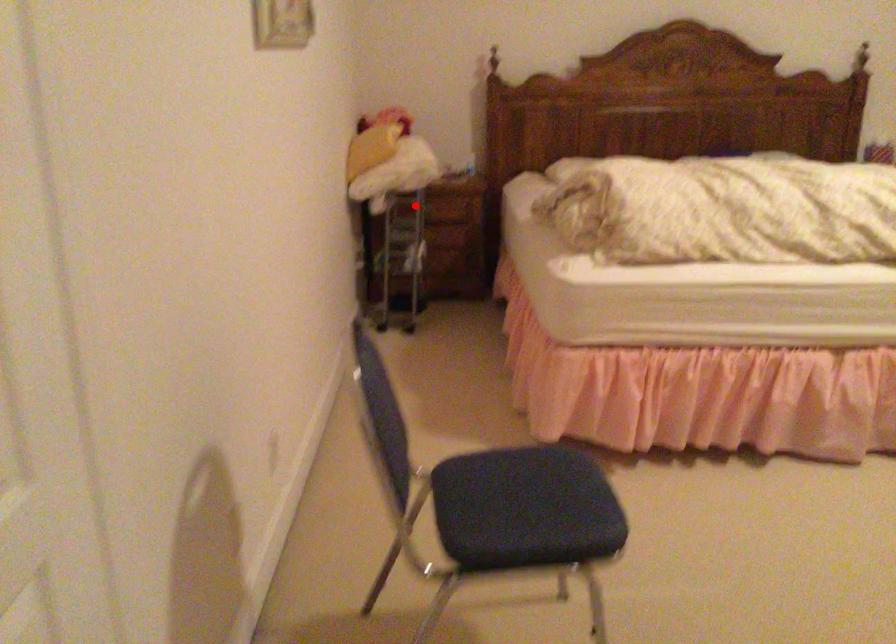
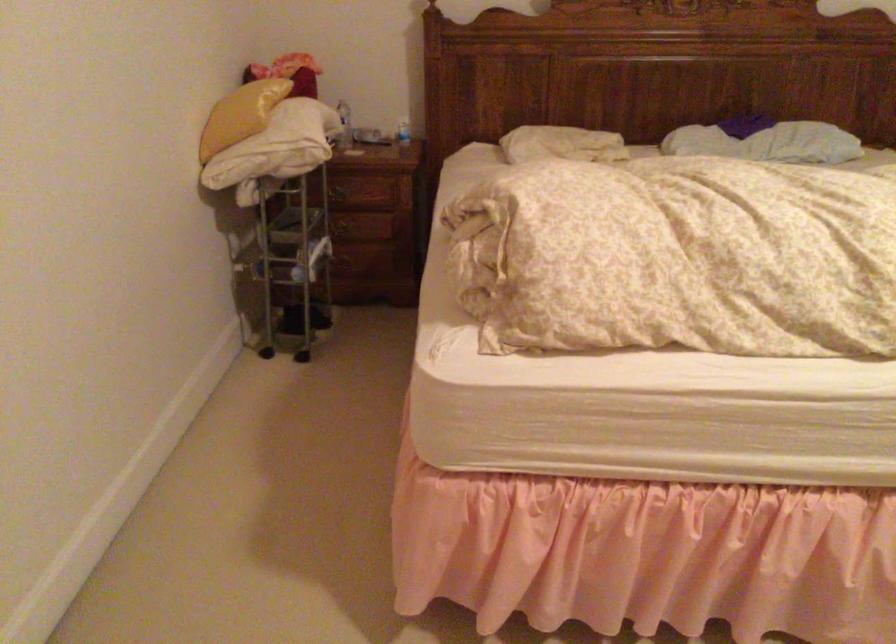
Question: I am providing you with two images of the same scene from different viewpoints. A red point is marked on the first image. Is the red point's position out of view in image 2?

Choices:
 (A) Yes
 (B) No

Answer: (B)